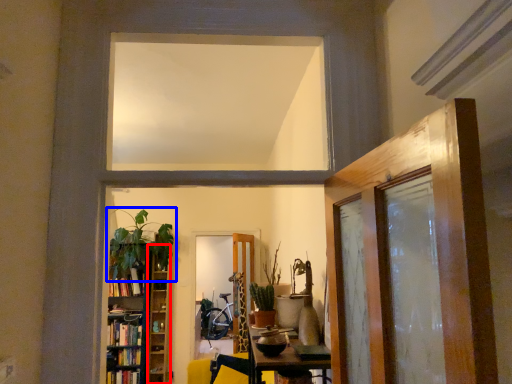
Question: Which object is closer to the camera taking this photo, shelf (highlighted by a red box) or houseplant (highlighted by a blue box)?

Choices:
 (A) shelf
 (B) houseplant

Answer: (B)